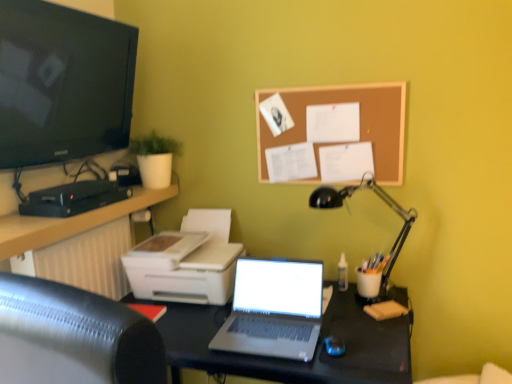
Question: In terms of height, does black glossy screen at upper left look taller or shorter compared to white plastic printer at lower left?

Choices:
 (A) tall
 (B) short

Answer: (A)

Question: Visually, is black glossy screen at upper left positioned to the left or to the right of white plastic printer at lower left?

Choices:
 (A) right
 (B) left

Answer: (B)

Question: Which is nearer to the metallic gray laptop at center?

Choices:
 (A) black glossy screen at upper left
 (B) black metal desk lamp at right
 (C) matte black entertainment center at left
 (D) white plastic printer at lower left
 (E) silver metallic laptop at center

Answer: (C)

Question: Which object is the farthest from the metallic gray laptop at center?

Choices:
 (A) silver metallic laptop at center
 (B) corkboard at upper center
 (C) black metal desk lamp at right
 (D) black glossy screen at upper left
 (E) white plastic printer at lower left

Answer: (D)